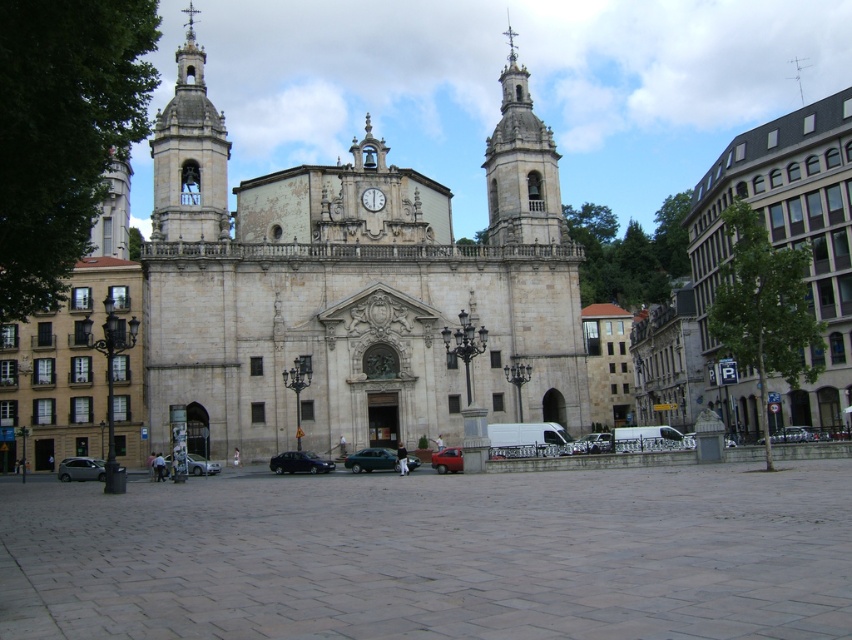
Question: Which point is farther from the camera taking this photo?

Choices:
 (A) (439, 460)
 (B) (303, 461)
 (C) (176, 195)
 (D) (389, 468)

Answer: (C)

Question: Can you confirm if slate gray stone church at center is smaller than silver metallic van at center?

Choices:
 (A) no
 (B) yes

Answer: (A)

Question: Is the position of metallic green car at center less distant than that of white stone clock at center?

Choices:
 (A) yes
 (B) no

Answer: (A)

Question: Which object is positioned farthest from the smooth stone tower at upper left?

Choices:
 (A) slate gray stone church at center
 (B) silver metallic van at center
 (C) shiny black car at center
 (D) stone bell tower at upper center

Answer: (B)

Question: Is silver metallic car at lower left positioned before white stone clock at center?

Choices:
 (A) no
 (B) yes

Answer: (B)

Question: Which point appears farthest from the camera in this image?

Choices:
 (A) (347, 458)
 (B) (281, 436)
 (C) (499, 166)
 (D) (380, 204)

Answer: (C)